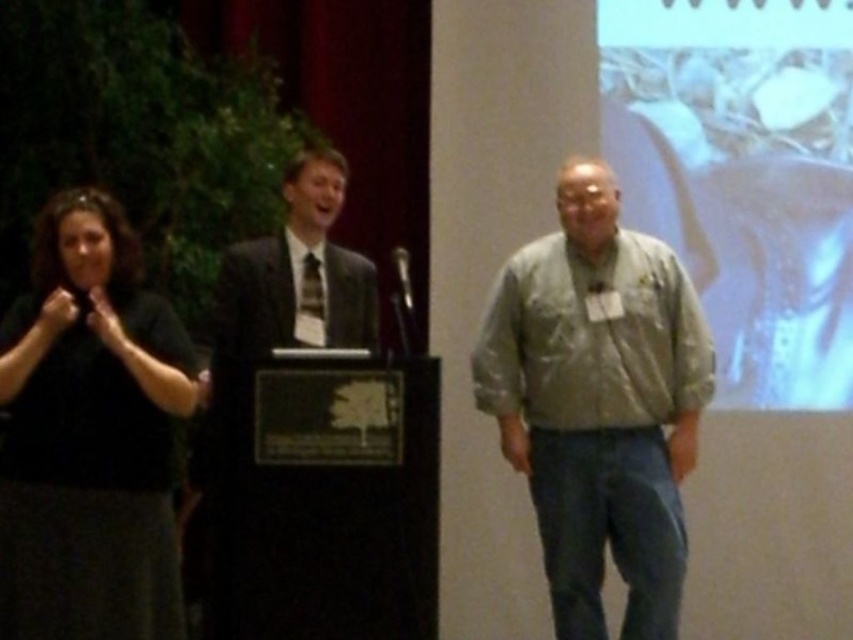
Question: Does black matte shirt at left come behind dark suit at center?

Choices:
 (A) no
 (B) yes

Answer: (A)

Question: Which point is farther from the camera taking this photo?

Choices:
 (A) (776, 88)
 (B) (614, 493)
 (C) (166, 561)

Answer: (A)

Question: Observing the image, what is the correct spatial positioning of white matte screen at upper right in reference to dark suit at center?

Choices:
 (A) below
 (B) above

Answer: (B)

Question: Which point is closer to the camera?

Choices:
 (A) light gray fabric shirt at center
 (B) dark suit at center
 (C) black matte shirt at left
 (D) white matte screen at upper right

Answer: (C)

Question: Based on their relative distances, which object is nearer to the black matte shirt at left?

Choices:
 (A) white matte screen at upper right
 (B) light gray fabric shirt at center

Answer: (B)

Question: Can you confirm if white matte screen at upper right is thinner than dark suit at center?

Choices:
 (A) no
 (B) yes

Answer: (A)